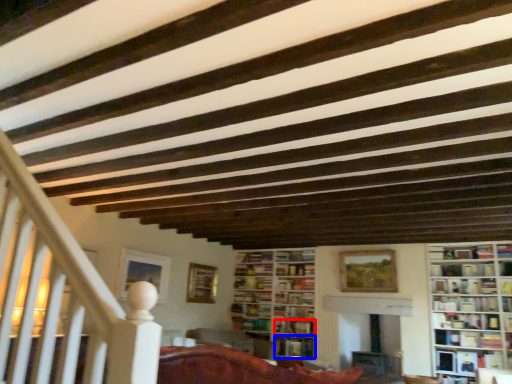
Question: Which point is closer to the camera, book (highlighted by a red box) or book (highlighted by a blue box)?

Choices:
 (A) book
 (B) book

Answer: (B)